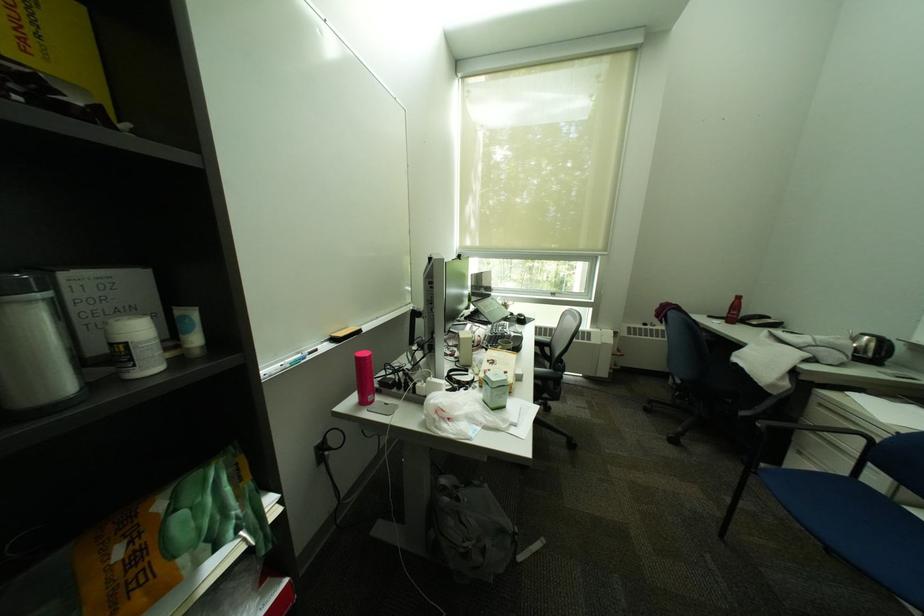
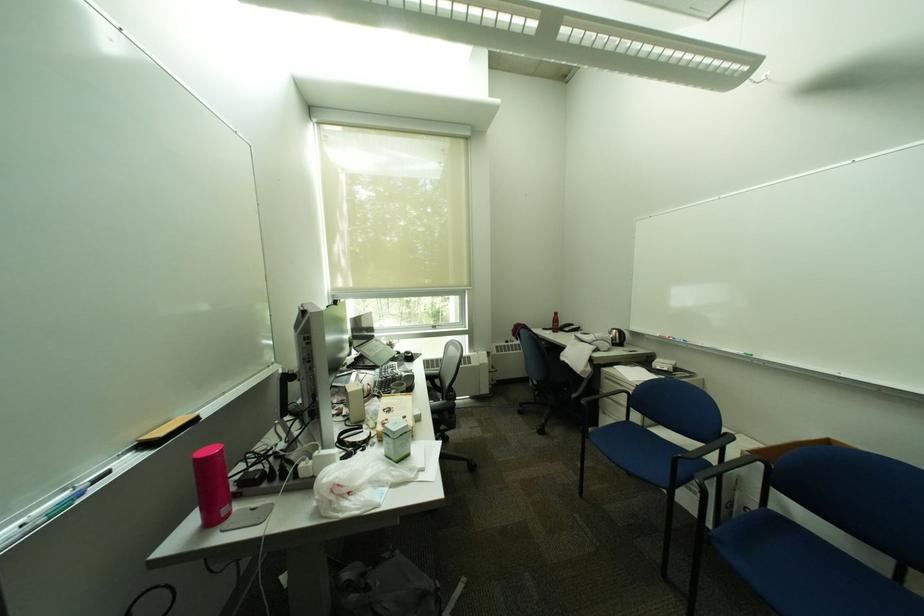
The point at (490, 488) is marked in the first image. Where is the corresponding point in the second image?

(400, 560)